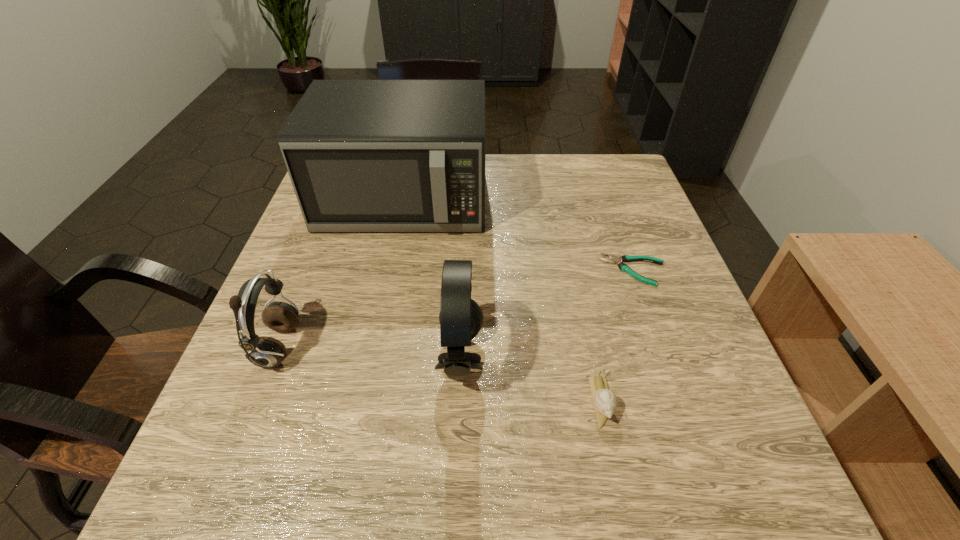
At what (x,y) coordinates should I click in order to perform the action: click on free space located 0.070m on the ear cups of the second tallest object. Please return your answer as a coordinate pair (x, y). Image resolution: width=960 pixels, height=540 pixels. Looking at the image, I should click on (522, 359).

At what (x,y) coordinates should I click in order to perform the action: click on vacant region located on the ear pads of the shorter earphone. Please return your answer as a coordinate pair (x, y). The width and height of the screenshot is (960, 540). Looking at the image, I should click on tap(493, 347).

The width and height of the screenshot is (960, 540). Find the location of `free location located 0.110m on the shell of the second object from right to left`. free location located 0.110m on the shell of the second object from right to left is located at coordinates (622, 503).

Find the location of a particular element. The image size is (960, 540). vacant space located 0.320m on the back of the pliers is located at coordinates (600, 176).

At what (x,y) coordinates should I click in order to perform the action: click on object located in the far edge section of the desktop. Please return your answer as a coordinate pair (x, y). The height and width of the screenshot is (540, 960). Looking at the image, I should click on (363, 155).

Locate an element on the screen. The image size is (960, 540). microwave oven that is at the left edge is located at coordinates (363, 155).

Where is `earphone that is at the left edge`? This screenshot has width=960, height=540. earphone that is at the left edge is located at coordinates (267, 352).

Find the location of a particular element. The image size is (960, 540). object situated at the right edge is located at coordinates (626, 258).

Locate an element on the screen. object that is positioned at the far left corner is located at coordinates (363, 155).

Locate an element on the screen. The width and height of the screenshot is (960, 540). vacant space at the far edge of the desktop is located at coordinates (545, 187).